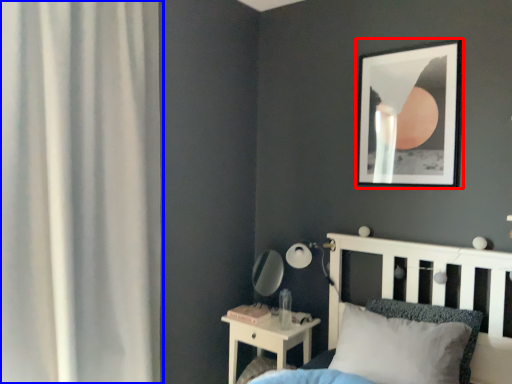
Question: Which of the following is the closest to the observer, picture frame (highlighted by a red box) or curtain (highlighted by a blue box)?

Choices:
 (A) picture frame
 (B) curtain

Answer: (B)